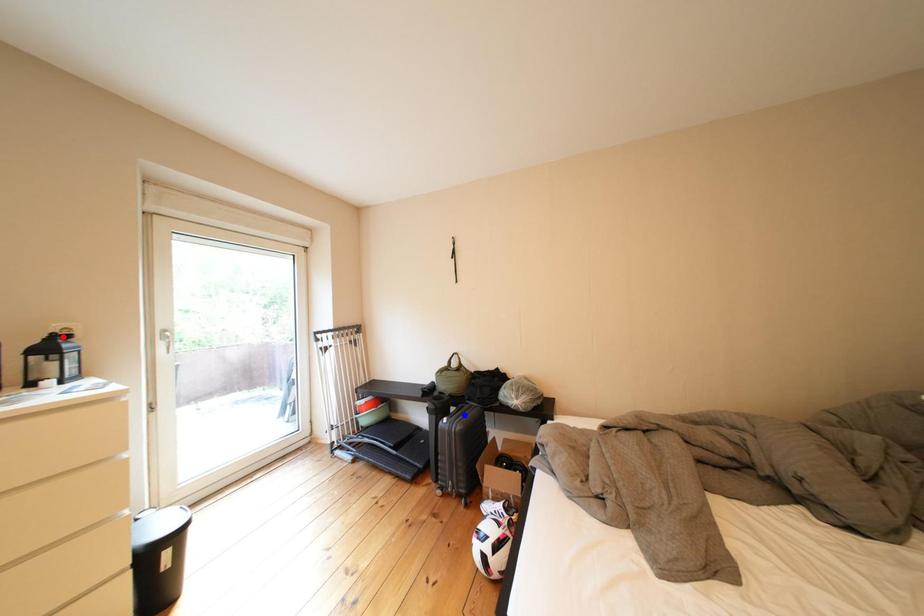
Question: In the image, two points are highlighted. Which point is nearer to the camera? Reply with the corresponding letter.

Choices:
 (A) blue point
 (B) red point

Answer: (B)